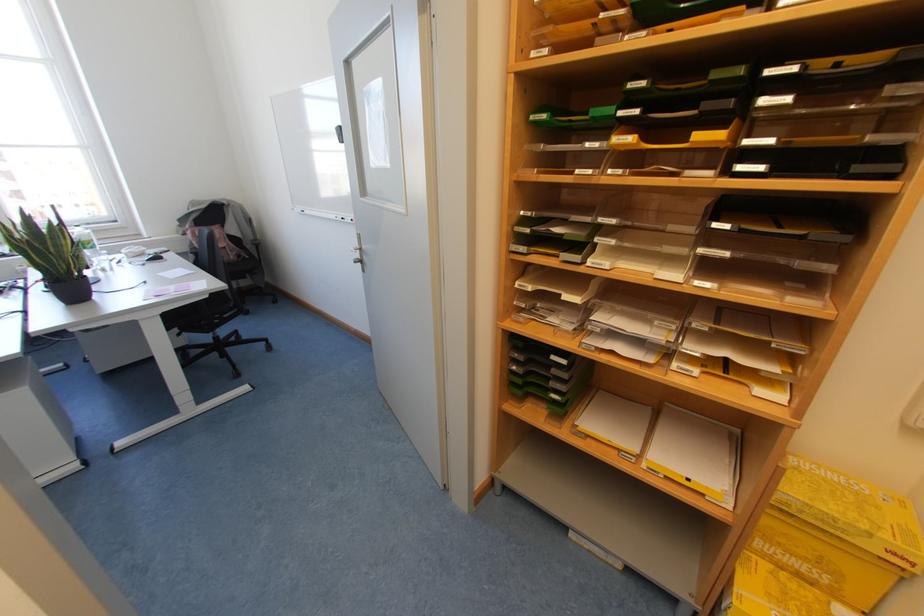
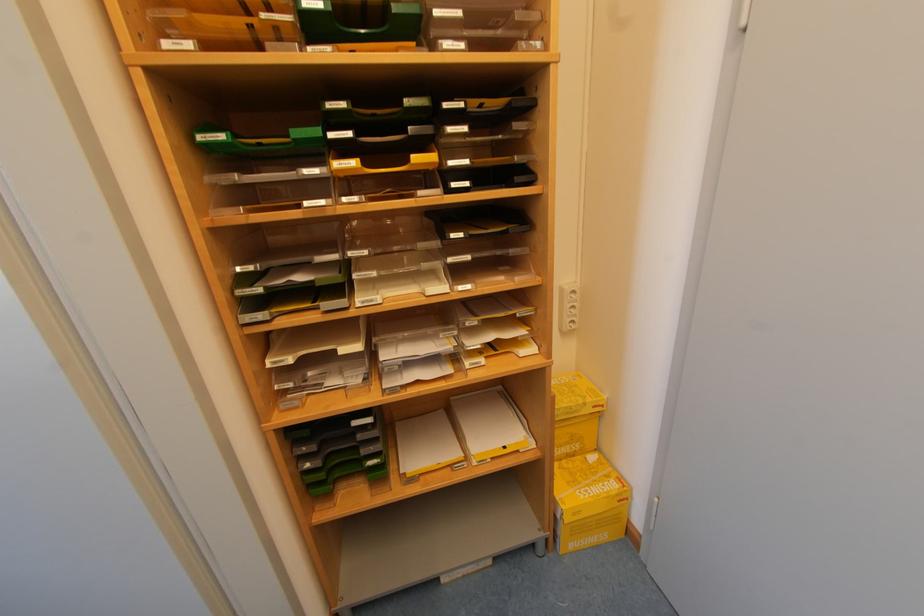
Question: The first image is from the beginning of the video and the second image is from the end. How did the camera likely rotate when shooting the video?

Choices:
 (A) Left
 (B) Right
 (C) Up
 (D) Down

Answer: (B)